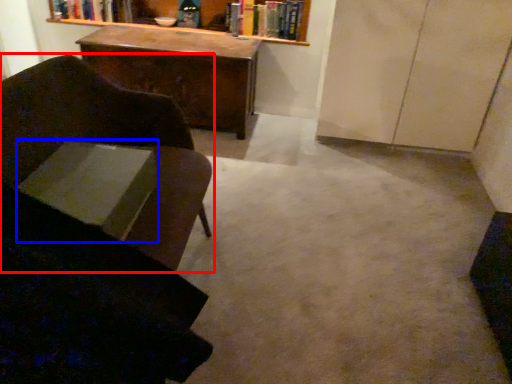
Question: Which object is further to the camera taking this photo, chair (highlighted by a red box) or book (highlighted by a blue box)?

Choices:
 (A) chair
 (B) book

Answer: (B)